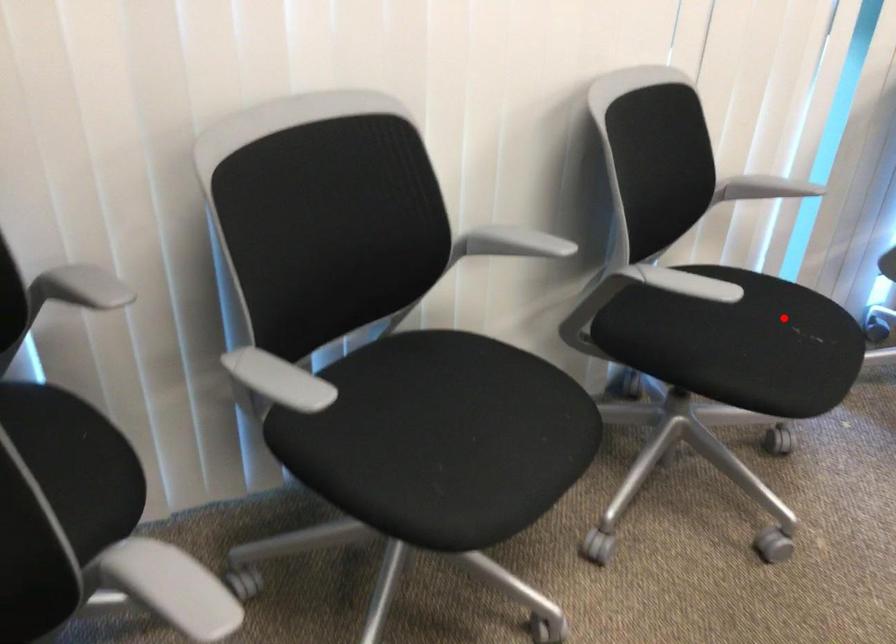
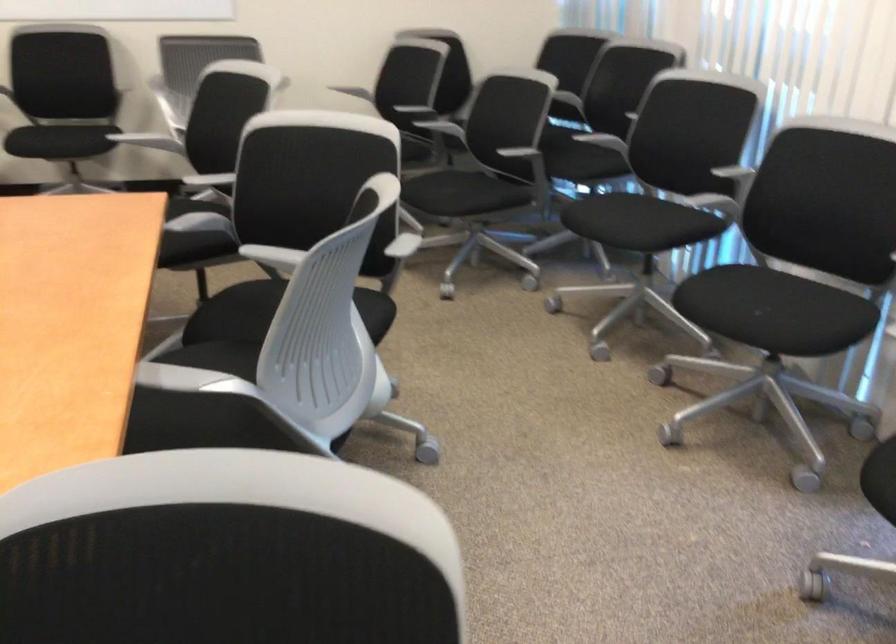
Where in the second image is the point corresponding to the highlighted location from the first image?

(771, 310)